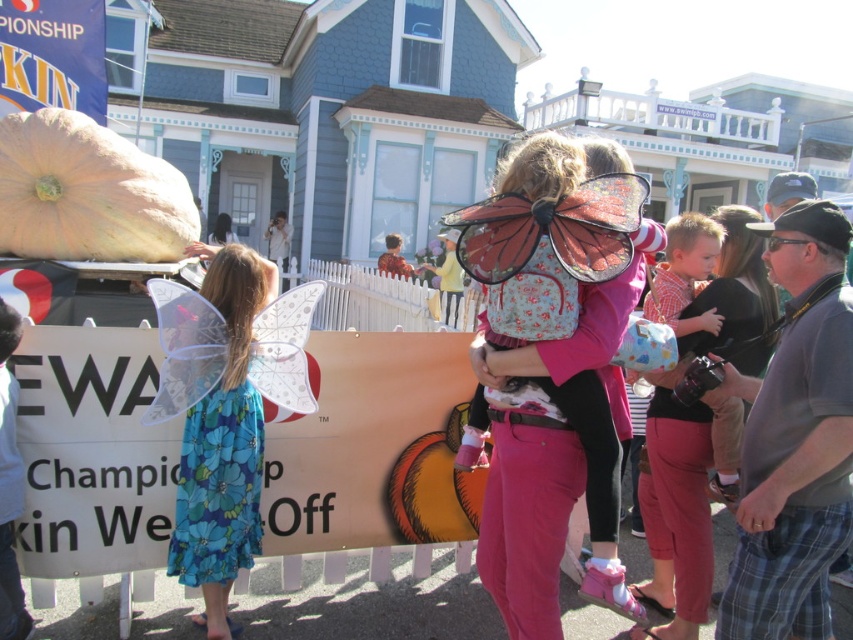
Where is `pink fabric wings at center`? This screenshot has height=640, width=853. pink fabric wings at center is located at coordinates (527, 529).

Is pink fabric wings at center shorter than blue floral dress at left?

Yes.

Locate an element on the screen. pink fabric wings at center is located at coordinates (527, 529).

Locate an element on the screen. The height and width of the screenshot is (640, 853). pink fabric wings at center is located at coordinates (527, 529).

Is matte pink pants at center bigger than blue floral dress at left?

Correct, matte pink pants at center is larger in size than blue floral dress at left.

Is matte pink pants at center taller than blue floral dress at left?

Yes.

Which is in front, point (701, 547) or point (256, 460)?

Point (256, 460) is more forward.

At what (x,y) coordinates should I click in order to perform the action: click on matte pink pants at center. Please return your answer as a coordinate pair (x, y). This screenshot has height=640, width=853. Looking at the image, I should click on (695, 433).

Is pink fabric wings at center thinner than matte pink pants at center?

Incorrect, pink fabric wings at center's width is not less than matte pink pants at center's.

Can you confirm if pink fabric wings at center is positioned above matte pink pants at center?

Indeed, pink fabric wings at center is positioned over matte pink pants at center.

Identify the location of pink fabric wings at center. Image resolution: width=853 pixels, height=640 pixels. (527, 529).